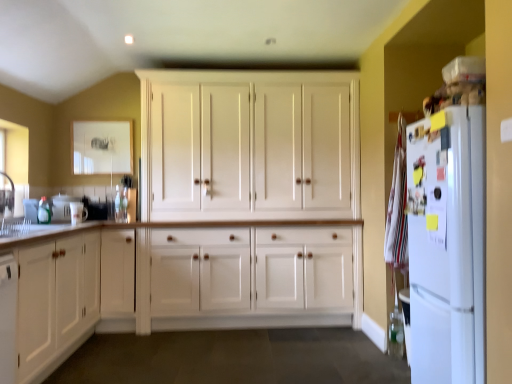
What do you see at coordinates (250, 145) in the screenshot? I see `white wood cabinet at center, positioned as the 2th cabinetry in left-to-right order` at bounding box center [250, 145].

How much space does white wood cabinet at left, which is the second cabinetry in right-to-left order, occupy horizontally?

It is 25.48 inches.

You are a GUI agent. You are given a task and a screenshot of the screen. Output one action in this format:
    pyautogui.click(x=<x>, y=<y>)
    Task: Click on the white wood cabinet at center, the first cabinetry when ordered from right to left
    
    Given the screenshot: What is the action you would take?
    pyautogui.click(x=250, y=145)

Is white wood cabinet at center, the first cabinetry when ordered from right to left, not near white glossy sink at left?

white wood cabinet at center, the first cabinetry when ordered from right to left, is far away from white glossy sink at left.

Is point (227, 137) closer or farther from the camera than point (49, 213)?

Point (227, 137).

Considering the relative sizes of white wood cabinet at center, marked as the 2th cabinetry in a front-to-back arrangement, and white glossy sink at left in the image provided, is white wood cabinet at center, marked as the 2th cabinetry in a front-to-back arrangement, taller than white glossy sink at left?

Yes.

From a real-world perspective, between white wood cabinet at center, arranged as the 1th cabinetry when viewed from the back, and white glossy sink at left, who is vertically lower?

white glossy sink at left, from a real-world perspective.

From the image's perspective, which is above, white matte refrigerator at right or white glossy mug at left?

From the image's view, white glossy mug at left is above.

Who is smaller, white matte refrigerator at right or white glossy mug at left?

white glossy mug at left.

Are white matte refrigerator at right and white glossy mug at left located far from each other?

Yes, white matte refrigerator at right and white glossy mug at left are quite far apart.

From a real-world perspective, which object rests below the other?

white matte refrigerator at right, from a real-world perspective.

From the image's perspective, would you say white wood cabinet at left, which is the second cabinetry in right-to-left order, is shown under white glossy sink at left?

Indeed, from the image's perspective, white wood cabinet at left, which is the second cabinetry in right-to-left order, is shown beneath white glossy sink at left.

Considering the points (21, 312) and (24, 207), which point is in front, point (21, 312) or point (24, 207)?

The point (21, 312) is closer to the camera.

Which is behind, white wood cabinet at left, which appears as the 1th cabinetry when viewed from the front, or white glossy sink at left?

white glossy sink at left is further from the camera.

Between white wood cabinet at left, acting as the first cabinetry starting from the left, and white glossy sink at left, which one appears on the left side from the viewer's perspective?

white glossy sink at left is more to the left.

Is white glossy mug at left oriented away from white wood cabinet at left, which is the second cabinetry in right-to-left order?

That's not correct — white glossy mug at left is not looking away from white wood cabinet at left, which is the second cabinetry in right-to-left order.

From a real-world perspective, is white glossy mug at left above or below white wood cabinet at left, which appears as the 1th cabinetry when viewed from the front?

white glossy mug at left is situated higher than white wood cabinet at left, which appears as the 1th cabinetry when viewed from the front, in the real world.

Is white glossy mug at left shorter than white wood cabinet at left, which appears as the 1th cabinetry when viewed from the front?

Correct, white glossy mug at left is not as tall as white wood cabinet at left, which appears as the 1th cabinetry when viewed from the front.

Can you confirm if white glossy mug at left is wider than white wood cabinet at left, which appears as the second cabinetry when viewed from the back?

No.

Does white wood cabinet at center, positioned as the 2th cabinetry in left-to-right order, have a larger size compared to white wood cabinet at left, which appears as the 1th cabinetry when viewed from the front?

Yes, white wood cabinet at center, positioned as the 2th cabinetry in left-to-right order, is bigger than white wood cabinet at left, which appears as the 1th cabinetry when viewed from the front.

What's the angular difference between white wood cabinet at center, positioned as the 2th cabinetry in left-to-right order, and white wood cabinet at left, acting as the first cabinetry starting from the left,'s facing directions?

89.4 degrees separate the facing orientations of white wood cabinet at center, positioned as the 2th cabinetry in left-to-right order, and white wood cabinet at left, acting as the first cabinetry starting from the left.

Which is in front, point (246, 187) or point (67, 345)?

Point (67, 345)

Is white wood cabinet at center, arranged as the 1th cabinetry when viewed from the back, inside or outside of white wood cabinet at left, acting as the first cabinetry starting from the left?

white wood cabinet at center, arranged as the 1th cabinetry when viewed from the back, is not enclosed by white wood cabinet at left, acting as the first cabinetry starting from the left.

Consider the image. Can you confirm if white glossy sink at left is wider than white glossy mug at left?

Correct, the width of white glossy sink at left exceeds that of white glossy mug at left.

Can you confirm if white glossy sink at left is positioned to the right of white glossy mug at left?

No, white glossy sink at left is not to the right of white glossy mug at left.

Can you confirm if white glossy sink at left is bigger than white glossy mug at left?

Yes.

Between point (33, 218) and point (84, 214), which one is positioned in front?

The point (33, 218) is closer to the camera.

Between white glossy mug at left and white matte refrigerator at right, which one has smaller size?

Smaller between the two is white glossy mug at left.

Considering the relative sizes of white glossy mug at left and white matte refrigerator at right in the image provided, is white glossy mug at left shorter than white matte refrigerator at right?

Yes.

Does point (74, 221) come in front of point (411, 309)?

No.

Looking at this image, considering the sizes of white glossy mug at left and white matte refrigerator at right in the image, is white glossy mug at left wider or thinner than white matte refrigerator at right?

Considering their sizes, white glossy mug at left looks slimmer than white matte refrigerator at right.

I want to click on sink behind the white wood cabinet at center, arranged as the 1th cabinetry when viewed from the back, so click(x=50, y=208).

This screenshot has width=512, height=384. In order to click on refrigerator that appears on the right of white glossy mug at left in this screenshot , I will do `click(447, 245)`.

From the image, which object appears to be nearer to white wood cabinet at left, which is the second cabinetry in right-to-left order, white wood cabinet at center, positioned as the 2th cabinetry in left-to-right order, or white glossy mug at left?

Among the two, white glossy mug at left is located nearer to white wood cabinet at left, which is the second cabinetry in right-to-left order.

Estimate the real-world distances between objects in this image. Which object is further from white glossy mug at left, white glossy sink at left or white matte refrigerator at right?

white matte refrigerator at right lies further to white glossy mug at left than the other object.

From the image, which object appears to be farther from white glossy mug at left, white matte refrigerator at right or white glossy sink at left?

The object further to white glossy mug at left is white matte refrigerator at right.

Based on their spatial positions, is white wood cabinet at center, positioned as the 2th cabinetry in left-to-right order, or white glossy sink at left further from white wood cabinet at left, acting as the first cabinetry starting from the left?

Among the two, white wood cabinet at center, positioned as the 2th cabinetry in left-to-right order, is located further to white wood cabinet at left, acting as the first cabinetry starting from the left.

Considering their positions, is white matte refrigerator at right positioned further to white glossy sink at left than white glossy mug at left?

white matte refrigerator at right is further to white glossy sink at left.

When comparing their distances from white matte refrigerator at right, does white wood cabinet at center, arranged as the 1th cabinetry when viewed from the back, or white glossy mug at left seem closer?

white wood cabinet at center, arranged as the 1th cabinetry when viewed from the back, lies closer to white matte refrigerator at right than the other object.

Looking at this image, estimate the real-world distances between objects in this image. Which object is closer to white glossy sink at left, white wood cabinet at left, which appears as the 1th cabinetry when viewed from the front, or white wood cabinet at center, arranged as the 1th cabinetry when viewed from the back?

white wood cabinet at left, which appears as the 1th cabinetry when viewed from the front, is positioned closer to the anchor white glossy sink at left.

From the image, which object appears to be nearer to white glossy sink at left, white glossy mug at left or white wood cabinet at left, which appears as the 1th cabinetry when viewed from the front?

white glossy mug at left is closer to white glossy sink at left.

At what (x,y) coordinates should I click in order to perform the action: click on appliance between white wood cabinet at left, acting as the first cabinetry starting from the left, and white glossy sink at left from front to back. Please return your answer as a coordinate pair (x, y). The image size is (512, 384). Looking at the image, I should click on (78, 213).

The width and height of the screenshot is (512, 384). I want to click on cabinetry between white glossy mug at left and white matte refrigerator at right from left to right, so click(x=250, y=145).

The image size is (512, 384). I want to click on cabinetry located between white glossy sink at left and white wood cabinet at center, marked as the 2th cabinetry in a front-to-back arrangement, in the left-right direction, so click(56, 302).

The image size is (512, 384). In order to click on appliance between white glossy sink at left and white wood cabinet at center, marked as the 2th cabinetry in a front-to-back arrangement in this screenshot , I will do `click(78, 213)`.